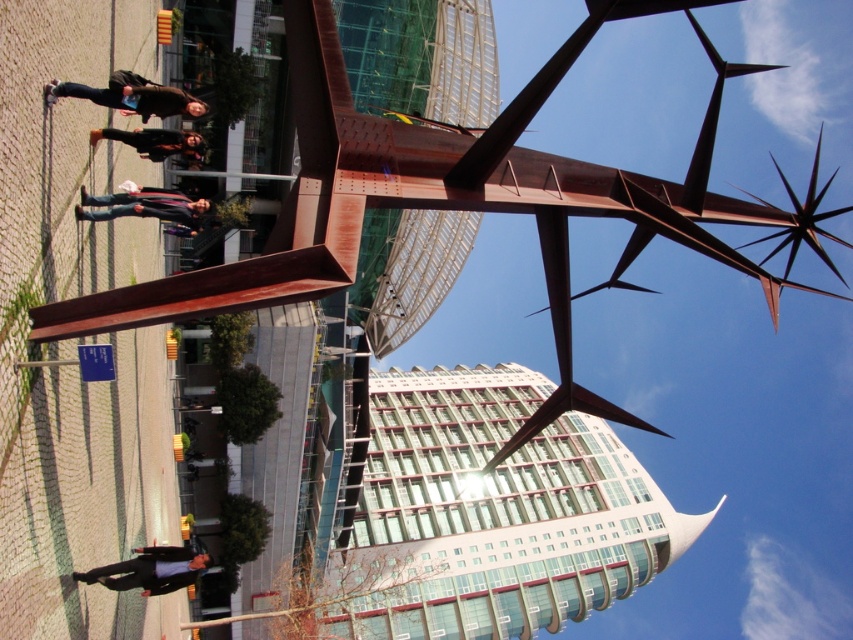
Which of these two, dark blue suit at lower left or rusty metal sculpture at left, stands taller?

rusty metal sculpture at left

Is dark blue suit at lower left closer to camera compared to rusty metal sculpture at left?

Yes.

Does point (164, 580) lie in front of point (160, 211)?

Yes, point (164, 580) is in front of point (160, 211).

The width and height of the screenshot is (853, 640). Identify the location of dark blue suit at lower left. (149, 570).

Does dark blue suit at lower left have a greater height compared to matte brown jacket at center?

No, dark blue suit at lower left is not taller than matte brown jacket at center.

Who is positioned more to the right, dark blue suit at lower left or matte brown jacket at center?

dark blue suit at lower left is more to the right.

Between point (90, 570) and point (141, 154), which one is positioned behind?

The point (141, 154) is more distant.

Where is `dark blue suit at lower left`? dark blue suit at lower left is located at coordinates (149, 570).

Is point (86, 218) closer to viewer compared to point (173, 131)?

Yes, it is in front of point (173, 131).

Does point (161, 205) lie in front of point (93, 140)?

No, (161, 205) is further to viewer.

The height and width of the screenshot is (640, 853). Find the location of `rusty metal sculpture at left`. rusty metal sculpture at left is located at coordinates (144, 205).